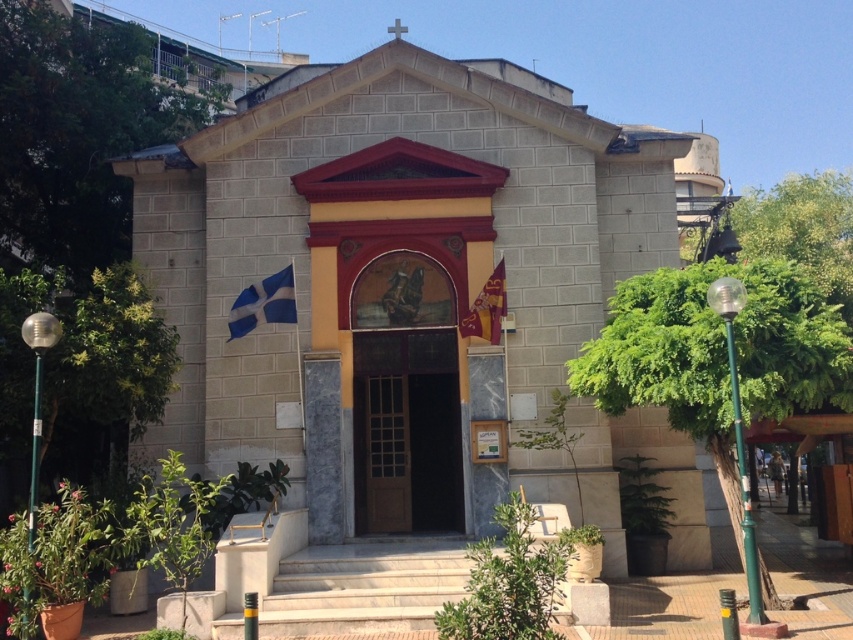
Between green leafy tree at right and brown wooden door at center, which one is positioned higher?

green leafy tree at right

Image resolution: width=853 pixels, height=640 pixels. What do you see at coordinates (717, 355) in the screenshot?
I see `green leafy tree at right` at bounding box center [717, 355].

At what (x,y) coordinates should I click in order to perform the action: click on green leafy tree at right. Please return your answer as a coordinate pair (x, y). Looking at the image, I should click on (717, 355).

Between green leafy tree at right and green leafy tree at lower left, which one is positioned lower?

Positioned lower is green leafy tree at right.

What do you see at coordinates (717, 355) in the screenshot?
I see `green leafy tree at right` at bounding box center [717, 355].

Who is more forward, (744, 380) or (143, 394)?

Point (744, 380) is more forward.

I want to click on green leafy tree at right, so point(717,355).

Does green leafy tree at right appear on the right side of white marble stairs at center?

Correct, you'll find green leafy tree at right to the right of white marble stairs at center.

Does green leafy tree at right have a greater height compared to white marble stairs at center?

Indeed, green leafy tree at right has a greater height compared to white marble stairs at center.

Who is more forward, (618, 340) or (231, 573)?

Positioned in front is point (231, 573).

Identify the location of green leafy tree at right. (717, 355).